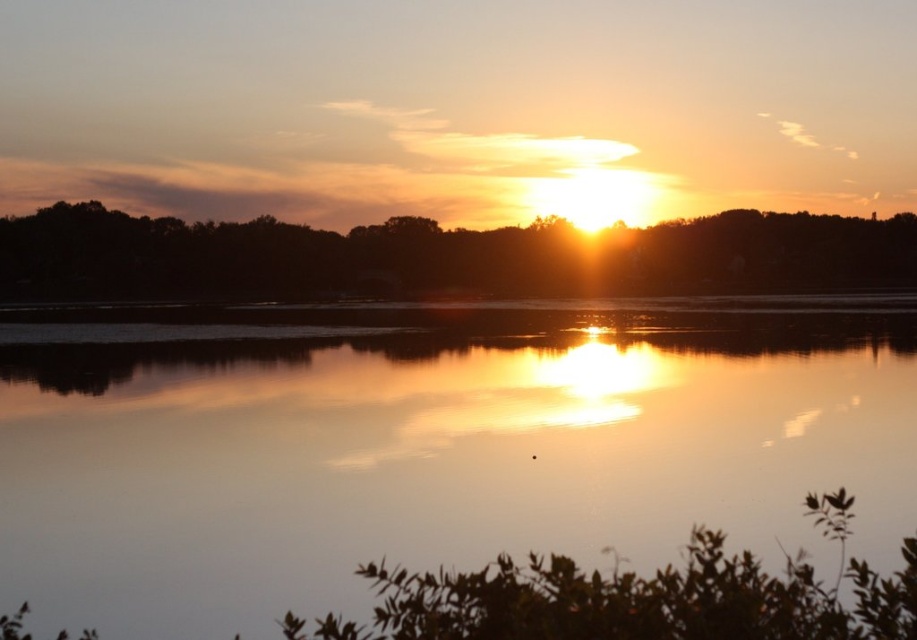
Question: Is glossy reflective water at center smaller than silhouette tree at upper center?

Choices:
 (A) yes
 (B) no

Answer: (A)

Question: Is glossy reflective water at center thinner than silhouette tree at upper center?

Choices:
 (A) no
 (B) yes

Answer: (B)

Question: Which of the following is the closest to the observer?

Choices:
 (A) (805, 406)
 (B) (241, 280)

Answer: (A)

Question: Is glossy reflective water at center further to the viewer compared to silhouette tree at upper center?

Choices:
 (A) no
 (B) yes

Answer: (A)